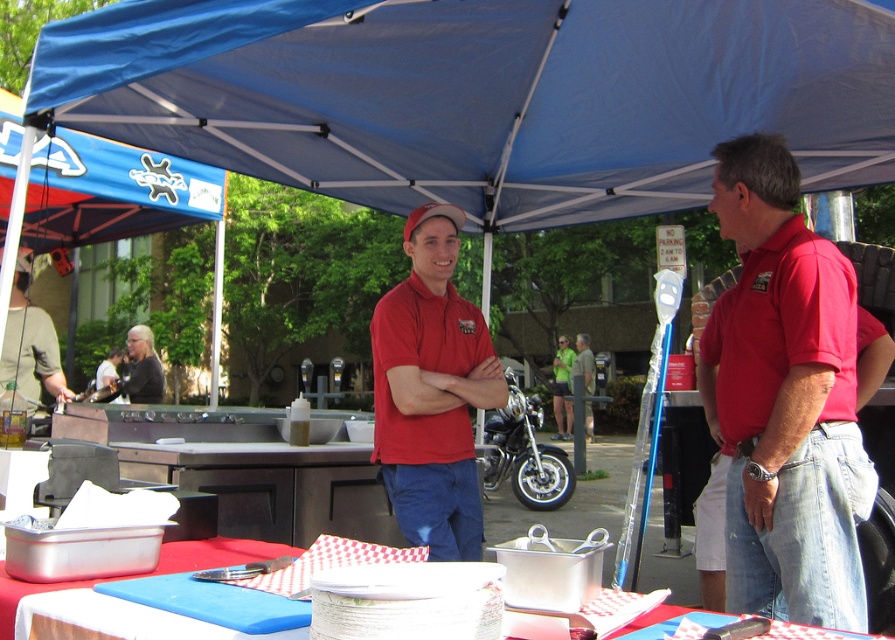
Based on the coordinates provided, which object is located at point (482, 96)?

The blue fabric canopy at upper center is located at point (482, 96).

You are standing at the event and want to reach the blue fabric canopy at upper center to adjust its position. Considering your height is 1.70 meters, can you comfortably reach it without any tools?

The blue fabric canopy at upper center is 2.10 meters from the viewer. Since your height is 1.70 meters, you cannot comfortably reach it without a ladder or tool.

You are at the event and want to locate the blue fabric canopy at upper center. From the perspective of someone standing where the matte red polo shirt at center is, which direction should you look?

The blue fabric canopy at upper center is to the right of the matte red polo shirt at center, so you should look to your right to find it.